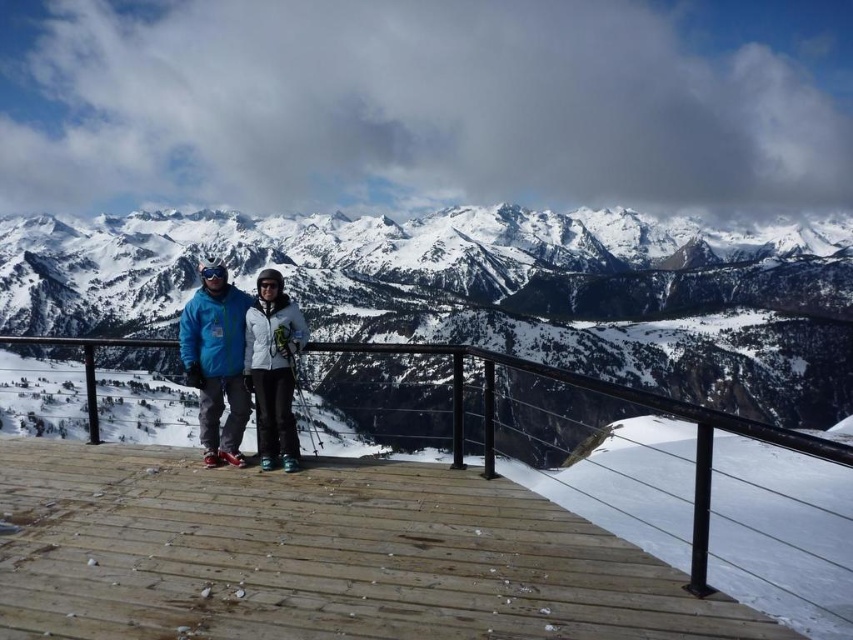
Question: Is black metal/rail at center further to camera compared to snowy granite mountains at upper center?

Choices:
 (A) yes
 (B) no

Answer: (B)

Question: Considering the relative positions of black metal/rail at center and white matte jacket at center in the image provided, where is black metal/rail at center located with respect to white matte jacket at center?

Choices:
 (A) right
 (B) left

Answer: (A)

Question: Which point is closer to the camera taking this photo?

Choices:
 (A) (236, 412)
 (B) (155, 532)
 (C) (289, 440)

Answer: (B)

Question: Is snowy granite mountains at upper center thinner than white matte jacket at center?

Choices:
 (A) yes
 (B) no

Answer: (B)

Question: Which point is closer to the camera?

Choices:
 (A) matte blue jacket at center
 (B) black metal/rail at center

Answer: (B)

Question: Which object is the closest to the snowy granite mountains at upper center?

Choices:
 (A) black metal/rail at center
 (B) white matte jacket at center

Answer: (A)